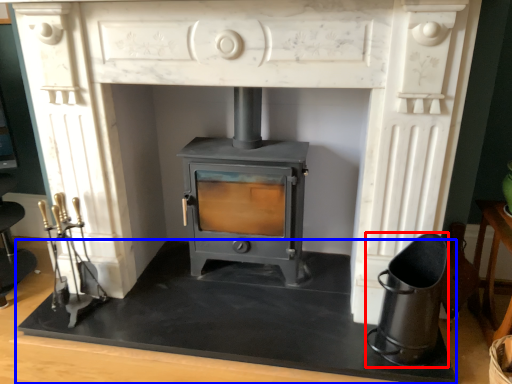
Question: Which point is further to the camera, appliance (highlighted by a red box) or slate (highlighted by a blue box)?

Choices:
 (A) appliance
 (B) slate

Answer: (B)